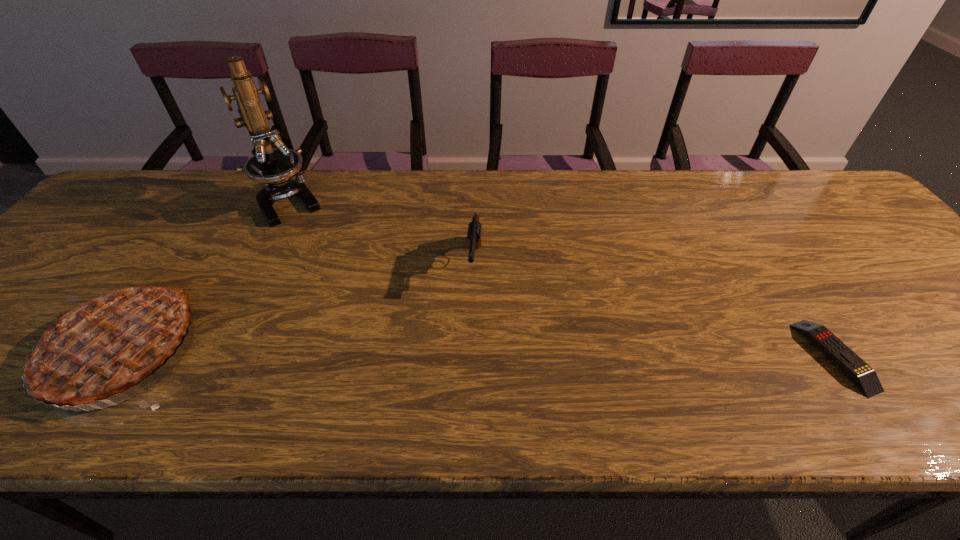
Where is `free space on the desktop that is between the second tallest object and the remote control and is positioned along the barrel of the second farthest object`? The width and height of the screenshot is (960, 540). free space on the desktop that is between the second tallest object and the remote control and is positioned along the barrel of the second farthest object is located at coordinates (466, 354).

This screenshot has height=540, width=960. What are the coordinates of `free space on the desktop that is between the pie and the remote control and is positioned at the eyepiece of the tallest object` in the screenshot? It's located at (390, 353).